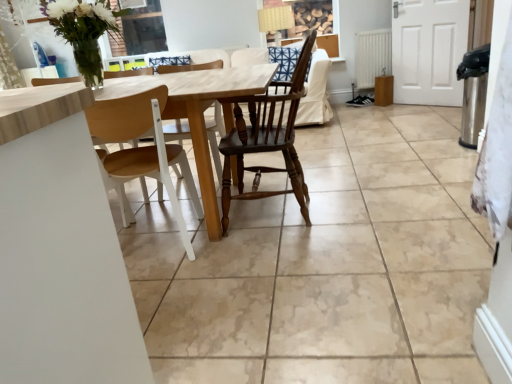
Find the location of a particular element. This screenshot has width=512, height=384. free spot above white matte radiator at right (from a real-world perspective) is located at coordinates (368, 28).